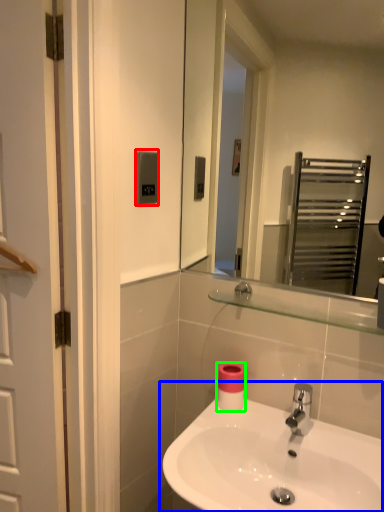
Question: Which object is positioned closest to light switch (highlighted by a red box)? Select from sink (highlighted by a blue box) and toilet paper (highlighted by a green box).

Choices:
 (A) sink
 (B) toilet paper

Answer: (B)